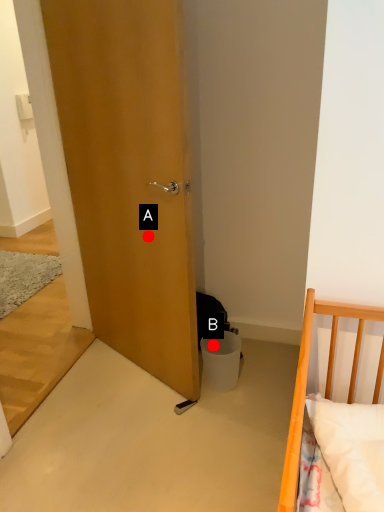
Question: Two points are circled on the image, labeled by A and B beside each circle. Which point is closer to the camera taking this photo?

Choices:
 (A) A is closer
 (B) B is closer

Answer: (A)